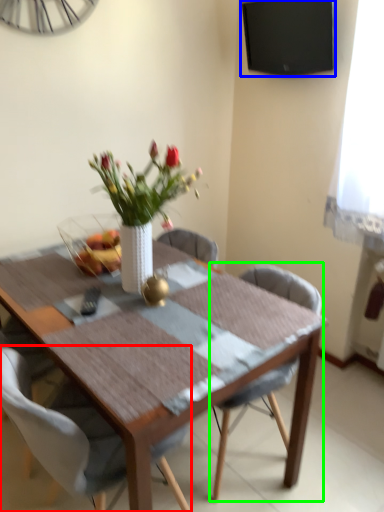
Question: Estimate the real-world distances between objects in this image. Which object is closer to chair (highlighted by a red box), television (highlighted by a blue box) or chair (highlighted by a green box)?

Choices:
 (A) television
 (B) chair

Answer: (B)